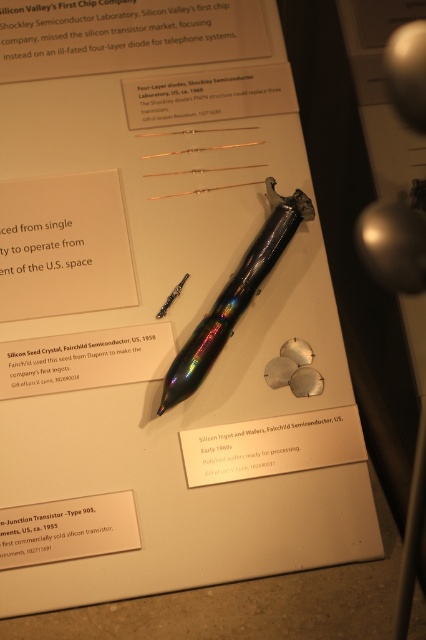
You are a museum visitor holding a 10cm wide notebook. You want to place your notebook next to the white paper at upper left and the rainbow iridescent pen at center. Can your notebook fit between them without overlapping?

The white paper at upper left has a lesser width compared to the rainbow iridescent pen at center. Since your notebook is 10cm wide, it depends on the actual widths of both objects. However, since the white paper is narrower, there might be enough space between them to fit the notebook. You should check the exact dimensions to be sure.

You are a museum visitor standing in front of the display panel. You notice the white paper at upper left and the three circular metallic wafers arranged in a triangular formation to the right of the central object. Based on their positions, can you determine which object is closer to the top edge of the display panel?

The white paper at upper left is closer to the top edge of the display panel because its position at point (63,246) places it higher up compared to the three circular metallic wafers arranged in a triangular formation to the right of the central object.

You are a museum visitor who wants to take a photo of both the white paper at upper left and the silicon seed crystal at center. Which object should you focus on first if you want to capture both in one frame without moving the camera?

The white paper at upper left is taller than the silicon seed crystal at center, so you should focus on the white paper at upper left first to ensure it fits within the frame since it is larger.